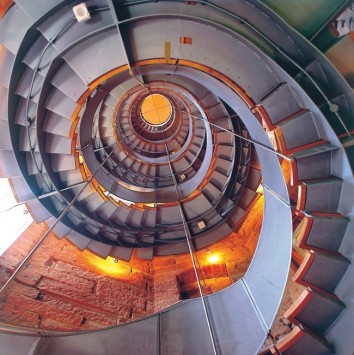
Where is `11 stairs`? 11 stairs is located at coordinates (44, 100).